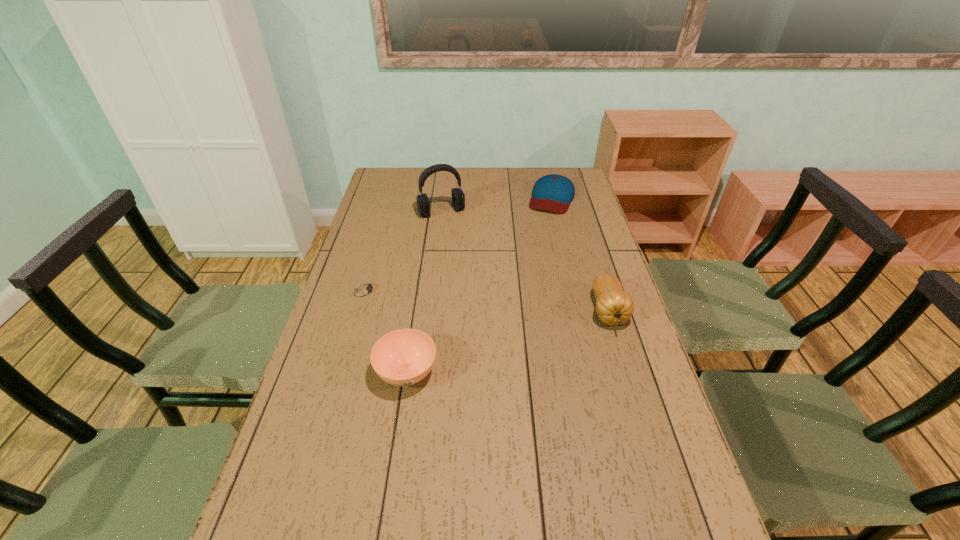
This screenshot has height=540, width=960. What are the coordinates of `baseball cap situated at the right edge` in the screenshot? It's located at (553, 192).

The image size is (960, 540). I want to click on object situated at the far right corner, so pyautogui.click(x=553, y=192).

Identify the location of free location at the near edge. Image resolution: width=960 pixels, height=540 pixels. (520, 513).

This screenshot has width=960, height=540. In order to click on vacant space at the left edge of the desktop in this screenshot , I will do `click(371, 261)`.

In the image, there is a desktop. Find the location of `free space at the right edge`. free space at the right edge is located at coordinates (560, 238).

This screenshot has width=960, height=540. Identify the location of free space at the far left corner of the desktop. (412, 172).

Where is `free point between the tallest object and the leftmost object`? This screenshot has width=960, height=540. free point between the tallest object and the leftmost object is located at coordinates (403, 251).

This screenshot has height=540, width=960. Find the location of `free space between the baseball cap and the gourd`. free space between the baseball cap and the gourd is located at coordinates (580, 255).

Identify the location of free space between the nearest object and the tallest object. (424, 292).

Find the location of `free area in between the headset and the baseball cap`. free area in between the headset and the baseball cap is located at coordinates (496, 205).